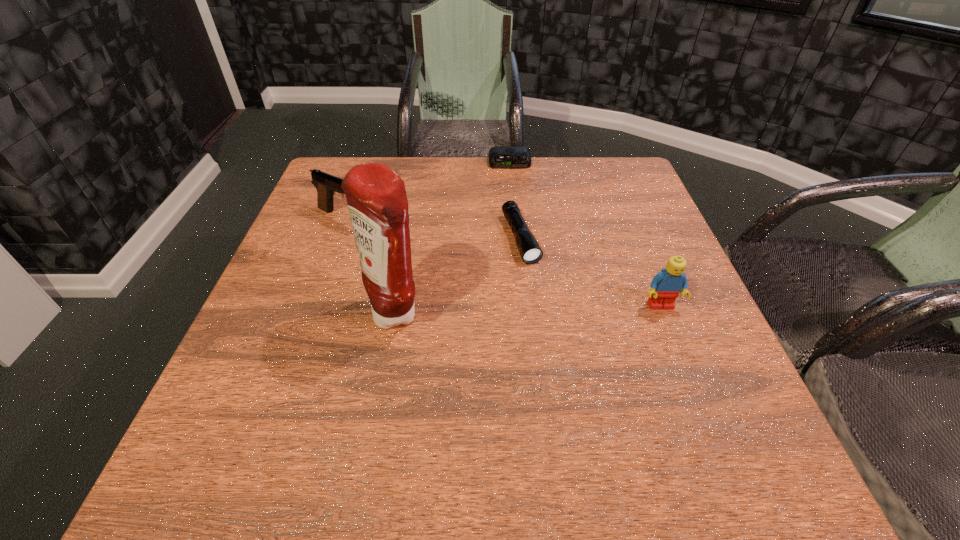
Identify the location of free space between the Lego and the pistol. (504, 262).

Locate an element on the screen. Image resolution: width=960 pixels, height=540 pixels. free space between the fourth tallest object and the rightmost object is located at coordinates (590, 272).

At what (x,y) coordinates should I click in order to perform the action: click on free space between the Lego and the pistol. Please return your answer as a coordinate pair (x, y). Looking at the image, I should click on (504, 262).

Find the location of `empty space that is in between the pistol and the Lego`. empty space that is in between the pistol and the Lego is located at coordinates (504, 262).

Where is `empty space that is in between the pistol and the fourth tallest object`? The width and height of the screenshot is (960, 540). empty space that is in between the pistol and the fourth tallest object is located at coordinates (434, 228).

Where is `vacant area between the rightmost object and the farthest object`? Image resolution: width=960 pixels, height=540 pixels. vacant area between the rightmost object and the farthest object is located at coordinates (586, 234).

This screenshot has height=540, width=960. In order to click on object that stands as the fourth closest to the flashlight in this screenshot , I will do `click(327, 185)`.

Find the location of a particular element. The width and height of the screenshot is (960, 540). the fourth closest object to the leftmost object is located at coordinates (666, 286).

You are a GUI agent. You are given a task and a screenshot of the screen. Output one action in this format:
    pyautogui.click(x=<x>, y=<y>)
    Task: Click on the vacant point that satisfies the following two spatial constraints: 1. on the front side of the fourth tallest object; 2. on the right side of the leftmost object
    Image resolution: width=960 pixels, height=540 pixels.
    Given the screenshot: What is the action you would take?
    pyautogui.click(x=341, y=238)

Identify the location of vacant space that satisfies the following two spatial constraints: 1. on the front side of the leftmost object; 2. on the left side of the condiment. (314, 313).